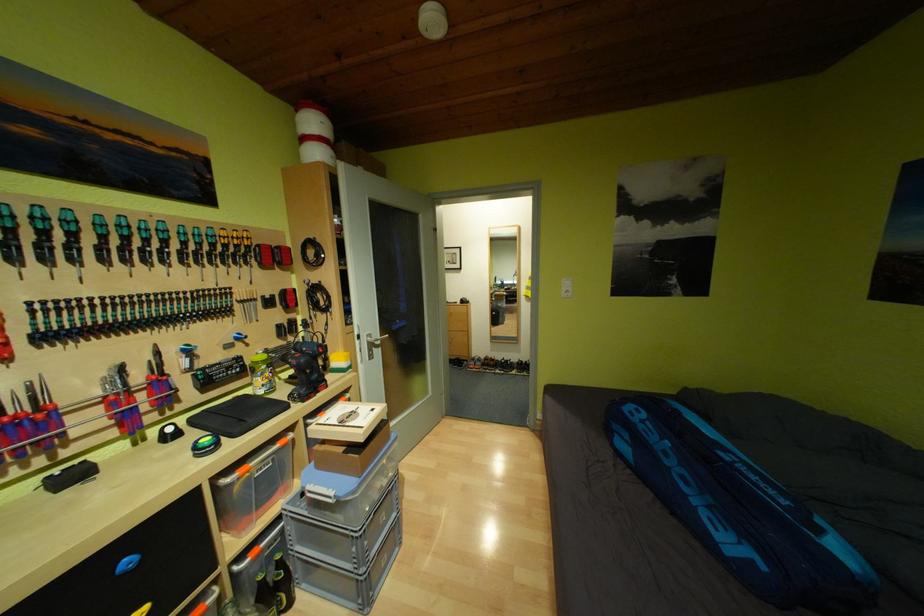
Where is `drill handle`? Image resolution: width=924 pixels, height=616 pixels. drill handle is located at coordinates pyautogui.click(x=307, y=369).